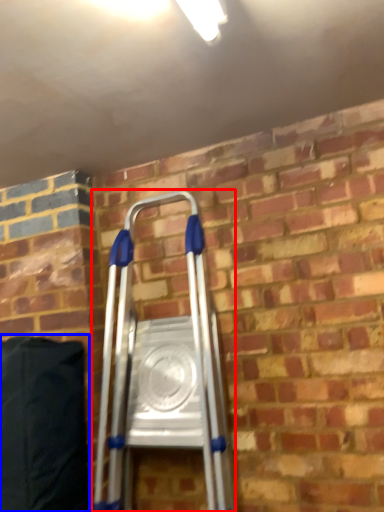
Question: Which of the following is the farthest to the observer, ladder (highlighted by a red box) or bean bag chair (highlighted by a blue box)?

Choices:
 (A) ladder
 (B) bean bag chair

Answer: (B)